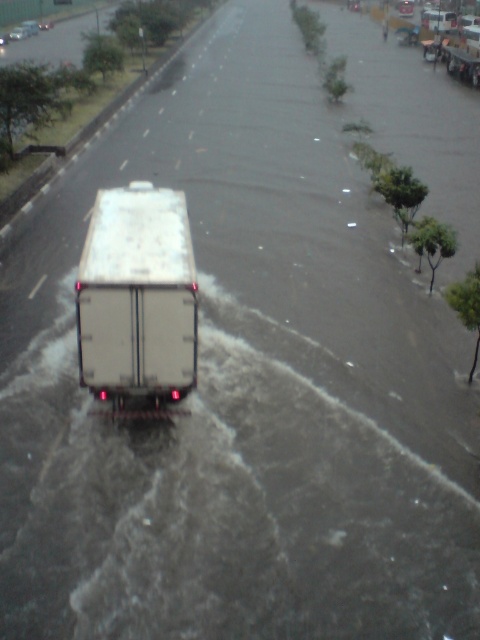
Question: Which object is farther from the camera taking this photo?

Choices:
 (A) white matte trailer truck at center
 (B) white matte truck at center

Answer: (B)

Question: Does white matte trailer truck at center have a lesser width compared to white matte truck at center?

Choices:
 (A) yes
 (B) no

Answer: (A)

Question: Does white matte trailer truck at center have a larger size compared to white matte truck at center?

Choices:
 (A) no
 (B) yes

Answer: (A)

Question: Can you confirm if white matte trailer truck at center is thinner than white matte truck at center?

Choices:
 (A) no
 (B) yes

Answer: (B)